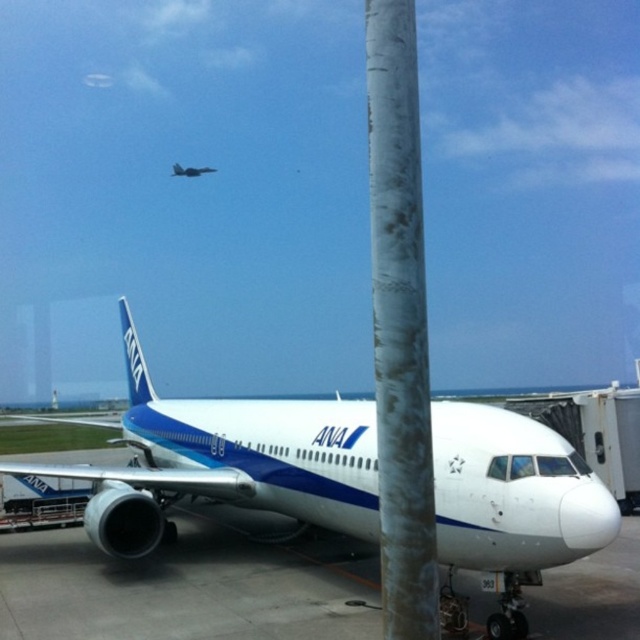
Between point (426, 580) and point (186, 168), which one is positioned behind?

Point (186, 168)

Can you confirm if gray textured pole at center is taller than metallic blue airplane at center?

Correct, gray textured pole at center is much taller as metallic blue airplane at center.

Describe the element at coordinates (400, 324) in the screenshot. I see `gray textured pole at center` at that location.

This screenshot has height=640, width=640. I want to click on gray textured pole at center, so click(x=400, y=324).

How much distance is there between white glossy airplane at center and gray textured pole at center?

white glossy airplane at center is 4.49 meters from gray textured pole at center.

Does point (576, 470) come in front of point (385, 102)?

No, (576, 470) is further to viewer.

This screenshot has width=640, height=640. Find the location of `white glossy airplane at center`. white glossy airplane at center is located at coordinates tap(225, 461).

Is white glossy airplane at center to the left of metallic blue airplane at center from the viewer's perspective?

No, white glossy airplane at center is not to the left of metallic blue airplane at center.

Is point (545, 557) positioned after point (189, 173)?

No.

The image size is (640, 640). Identify the location of white glossy airplane at center. (225, 461).

This screenshot has width=640, height=640. Find the location of `white glossy airplane at center`. white glossy airplane at center is located at coordinates (225, 461).